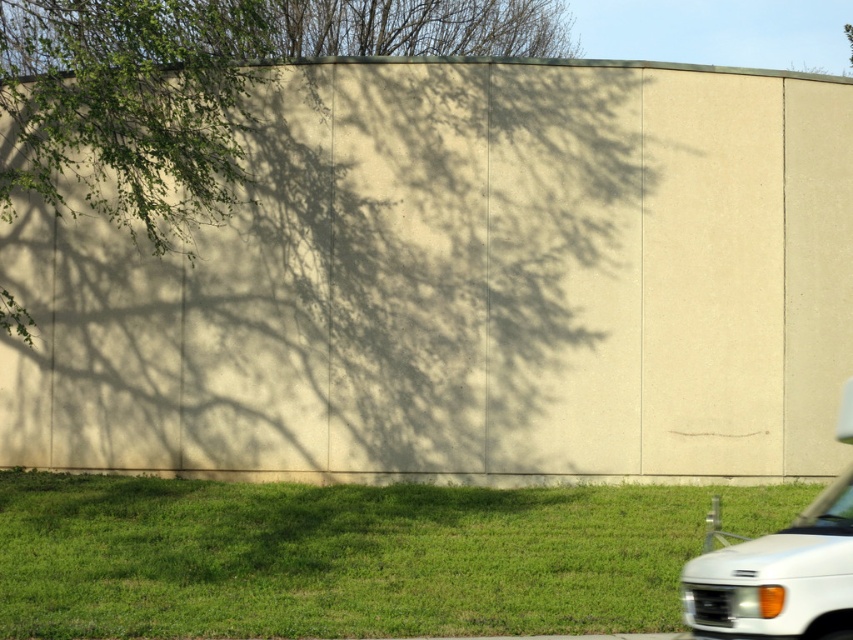
You are standing in the grassy area and want to walk towards the beige wall. Which direction should you move to avoid stepping on the green grass at lower right?

The green grass at lower right is located at point (351, 556). To avoid stepping on it, move towards the beige wall in a direction away from the lower right, such as towards the upper left or center.

You are standing at the camera position and want to walk to the green grass at lower right. How far will you have to walk?

The green grass at lower right is 36.59 feet from the camera, so you will have to walk 36.59 feet to reach it.

You are standing in the grassy area and want to park your white matte van at lower right next to the green grass at lower right. Given the space available, can the van fit alongside the grass without overlapping?

The green grass at lower right is wider than the white matte van at lower right, so there is enough space for the van to fit alongside the grass without overlapping.